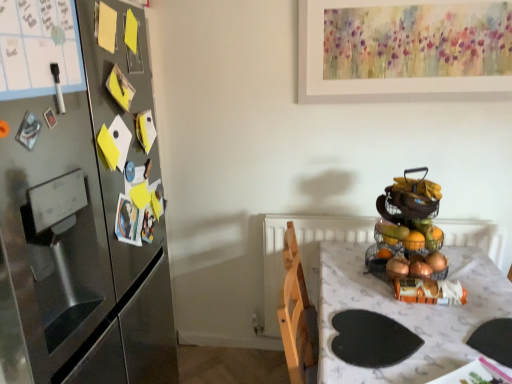
What do you see at coordinates (375, 262) in the screenshot? I see `wire mesh basket at right, which appears as the first basket when ordered from the bottom` at bounding box center [375, 262].

The image size is (512, 384). What do you see at coordinates (408, 313) in the screenshot?
I see `white glossy table at center` at bounding box center [408, 313].

Describe the element at coordinates (82, 193) in the screenshot. The height and width of the screenshot is (384, 512). I see `stainless steel refrigerator at left` at that location.

Find the location of a particular element. wire mesh basket at right, which appears as the first basket when ordered from the bottom is located at coordinates (375, 262).

Is white glossy table at center facing towards stainless steel refrigerator at left?

No, white glossy table at center is not facing towards stainless steel refrigerator at left.

Which object is further away from the camera taking this photo, white glossy table at center or stainless steel refrigerator at left?

white glossy table at center is further from the camera.

Is stainless steel refrigerator at left aimed at wire mesh basket at right, which appears as the first basket when ordered from the bottom?

Yes, stainless steel refrigerator at left is facing wire mesh basket at right, which appears as the first basket when ordered from the bottom.

Considering the sizes of objects stainless steel refrigerator at left and wire mesh basket at right, the 2th basket when ordered from top to bottom, in the image provided, who is bigger, stainless steel refrigerator at left or wire mesh basket at right, the 2th basket when ordered from top to bottom,?

stainless steel refrigerator at left.

Looking at this image, from the image's perspective, relative to wire mesh basket at right, the 2th basket when ordered from top to bottom, is stainless steel refrigerator at left above or below?

stainless steel refrigerator at left is situated lower than wire mesh basket at right, the 2th basket when ordered from top to bottom, in the image.

Identify the location of cabinetry in front of the wire mesh basket at right, which appears as the first basket when ordered from the bottom. (82, 193).

Is white glossy table at center located within wire mesh basket at right, the 2th basket when ordered from top to bottom?

No, white glossy table at center is located outside of wire mesh basket at right, the 2th basket when ordered from top to bottom.

Considering the positions of objects wire mesh basket at right, the 2th basket when ordered from top to bottom, and white glossy table at center in the image provided, who is behind, wire mesh basket at right, the 2th basket when ordered from top to bottom, or white glossy table at center?

Positioned behind is wire mesh basket at right, the 2th basket when ordered from top to bottom.

Is wire mesh basket at right, the 2th basket when ordered from top to bottom, positioned far away from white glossy table at center?

Actually, wire mesh basket at right, the 2th basket when ordered from top to bottom, and white glossy table at center are a little close together.

From a real-world perspective, is wire mesh basket at right, the 2th basket when ordered from top to bottom, above or below white glossy table at center?

wire mesh basket at right, the 2th basket when ordered from top to bottom, is above white glossy table at center.

Which object is thinner, wire mesh basket at right, which appears as the first basket when ordered from the bottom, or stainless steel refrigerator at left?

wire mesh basket at right, which appears as the first basket when ordered from the bottom.

Is point (414, 253) behind point (32, 236)?

That is True.

Who is shorter, wire mesh basket at right, which appears as the first basket when ordered from the bottom, or stainless steel refrigerator at left?

Standing shorter between the two is wire mesh basket at right, which appears as the first basket when ordered from the bottom.

Is wire mesh basket at right, the 2th basket when ordered from top to bottom, not within stainless steel refrigerator at left?

wire mesh basket at right, the 2th basket when ordered from top to bottom, is positioned outside stainless steel refrigerator at left.

Image resolution: width=512 pixels, height=384 pixels. Identify the location of the 1st basket behind the white glossy table at center. (409, 236).

Considering the sizes of objects white glossy table at center and wire mesh fruit basket at right, the second basket from the bottom, in the image provided, who is shorter, white glossy table at center or wire mesh fruit basket at right, the second basket from the bottom,?

With less height is wire mesh fruit basket at right, the second basket from the bottom.

Considering the relative sizes of white glossy table at center and wire mesh fruit basket at right, acting as the first basket starting from the top, in the image provided, is white glossy table at center thinner than wire mesh fruit basket at right, acting as the first basket starting from the top,?

Incorrect, the width of white glossy table at center is not less than that of wire mesh fruit basket at right, acting as the first basket starting from the top.

Between white glossy table at center and wire mesh basket at right, which appears as the first basket when ordered from the bottom, which one is positioned behind?

wire mesh basket at right, which appears as the first basket when ordered from the bottom.

Does white glossy table at center have a larger size compared to wire mesh basket at right, the 2th basket when ordered from top to bottom?

Yes.

Between white glossy table at center and wire mesh basket at right, the 2th basket when ordered from top to bottom, which one appears on the right side from the viewer's perspective?

From the viewer's perspective, wire mesh basket at right, the 2th basket when ordered from top to bottom, appears more on the right side.

Is stainless steel refrigerator at left turned away from wire mesh fruit basket at right, acting as the first basket starting from the top?

No, stainless steel refrigerator at left's orientation is not away from wire mesh fruit basket at right, acting as the first basket starting from the top.

Consider the image. Between stainless steel refrigerator at left and wire mesh fruit basket at right, the second basket from the bottom, which one has smaller width?

wire mesh fruit basket at right, the second basket from the bottom.

Is stainless steel refrigerator at left closer to the viewer compared to wire mesh fruit basket at right, acting as the first basket starting from the top?

Yes.

Who is taller, stainless steel refrigerator at left or wire mesh fruit basket at right, acting as the first basket starting from the top?

Standing taller between the two is stainless steel refrigerator at left.

Where is `desk to the right of stainless steel refrigerator at left`? desk to the right of stainless steel refrigerator at left is located at coordinates (408, 313).

Find the location of a particular element. The width and height of the screenshot is (512, 384). basket that is the 1st object located above the stainless steel refrigerator at left (from the image's perspective) is located at coordinates (375, 262).

When comparing their distances from wire mesh fruit basket at right, acting as the first basket starting from the top, does stainless steel refrigerator at left or wire mesh basket at right, which appears as the first basket when ordered from the bottom, seem closer?

wire mesh basket at right, which appears as the first basket when ordered from the bottom, is positioned closer to the anchor wire mesh fruit basket at right, acting as the first basket starting from the top.

Looking at the image, which one is located closer to wire mesh fruit basket at right, the second basket from the bottom, white glossy table at center or wire mesh basket at right, the 2th basket when ordered from top to bottom?

wire mesh basket at right, the 2th basket when ordered from top to bottom, lies closer to wire mesh fruit basket at right, the second basket from the bottom, than the other object.

Which object lies nearer to the anchor point wire mesh basket at right, the 2th basket when ordered from top to bottom, wire mesh fruit basket at right, the second basket from the bottom, or white glossy table at center?

wire mesh fruit basket at right, the second basket from the bottom.

Estimate the real-world distances between objects in this image. Which object is closer to white glossy table at center, stainless steel refrigerator at left or wire mesh fruit basket at right, acting as the first basket starting from the top?

wire mesh fruit basket at right, acting as the first basket starting from the top, is closer to white glossy table at center.

Looking at the image, which one is located further to wire mesh basket at right, which appears as the first basket when ordered from the bottom, white glossy table at center or wire mesh fruit basket at right, the second basket from the bottom?

white glossy table at center is further to wire mesh basket at right, which appears as the first basket when ordered from the bottom.

When comparing their distances from stainless steel refrigerator at left, does wire mesh basket at right, the 2th basket when ordered from top to bottom, or white glossy table at center seem closer?

Among the two, white glossy table at center is located nearer to stainless steel refrigerator at left.

Looking at the image, which one is located closer to wire mesh basket at right, the 2th basket when ordered from top to bottom, stainless steel refrigerator at left or wire mesh fruit basket at right, the second basket from the bottom?

Based on the image, wire mesh fruit basket at right, the second basket from the bottom, appears to be nearer to wire mesh basket at right, the 2th basket when ordered from top to bottom.

Estimate the real-world distances between objects in this image. Which object is closer to white glossy table at center, wire mesh fruit basket at right, acting as the first basket starting from the top, or wire mesh basket at right, the 2th basket when ordered from top to bottom?

Among the two, wire mesh basket at right, the 2th basket when ordered from top to bottom, is located nearer to white glossy table at center.

You are a GUI agent. You are given a task and a screenshot of the screen. Output one action in this format:
    pyautogui.click(x=<x>, y=<y>)
    Task: Click on the desk between stainless steel refrigerator at left and wire mesh basket at right, which appears as the first basket when ordered from the bottom
    
    Given the screenshot: What is the action you would take?
    pyautogui.click(x=408, y=313)

The image size is (512, 384). What are the coordinates of `basket between stainless steel refrigerator at left and wire mesh basket at right, which appears as the first basket when ordered from the bottom, from left to right` in the screenshot? It's located at (409, 236).

Where is `basket between white glossy table at center and wire mesh basket at right, which appears as the first basket when ordered from the bottom, along the z-axis`? This screenshot has width=512, height=384. basket between white glossy table at center and wire mesh basket at right, which appears as the first basket when ordered from the bottom, along the z-axis is located at coordinates (409, 236).

You are a GUI agent. You are given a task and a screenshot of the screen. Output one action in this format:
    pyautogui.click(x=<x>, y=<y>)
    Task: Click on the desk located between stainless steel refrigerator at left and wire mesh fruit basket at right, the second basket from the bottom, in the left-right direction
    This screenshot has height=384, width=512.
    Given the screenshot: What is the action you would take?
    pyautogui.click(x=408, y=313)